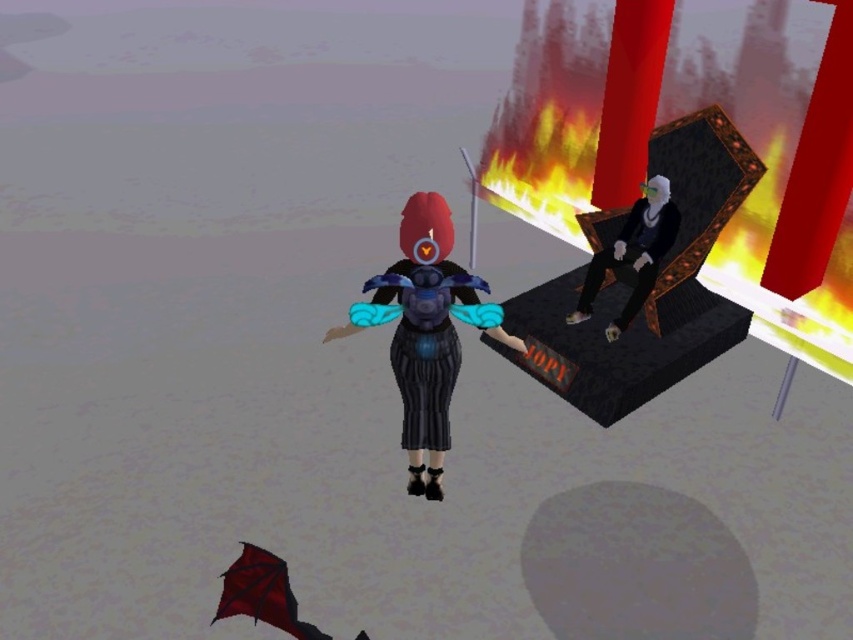
You are a character in the scene and want to sit on the smooth black chair at right. Is the shiny blue dress at center blocking your path to the chair?

The shiny blue dress at center is in front of the smooth black chair at right, so it is blocking the path to the chair.

You are a character in the scene and want to sit on the smooth black chair at right. However, there is a shiny blue dress at center in the way. Can you move the dress to reach the chair?

The shiny blue dress at center is below the smooth black chair at right, so the dress is located under the chair. Since the dress is underneath the chair, it is not blocking your path to reach the chair, so you can move towards the chair without needing to move the dress.

You are standing in the room with the throne and want to find the shiny blue dress at center. According to the scene description, where should you look to find it?

The shiny blue dress at center is located at point (426, 330), which is near the center of the scene.